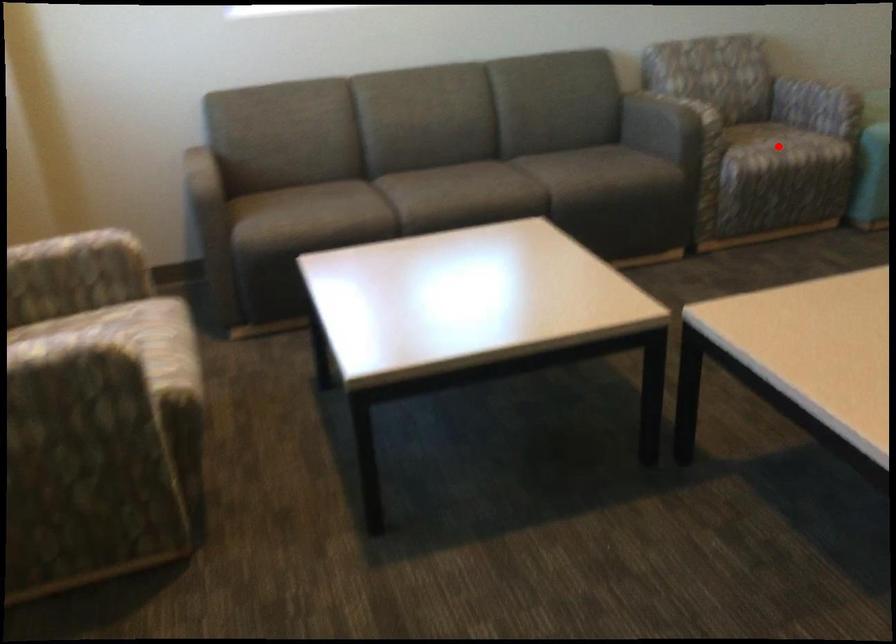
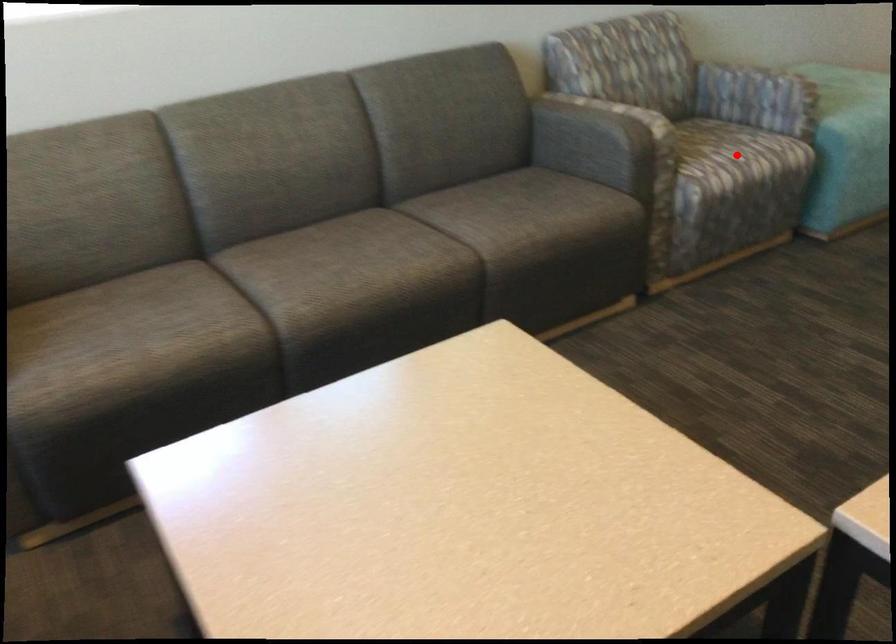
From the picture: I am providing you with two images of the same scene from different viewpoints. A red point is marked on the first image and another point is marked on the second image. Are the points marked in image1 and image2 representing the same 3D position?

Yes